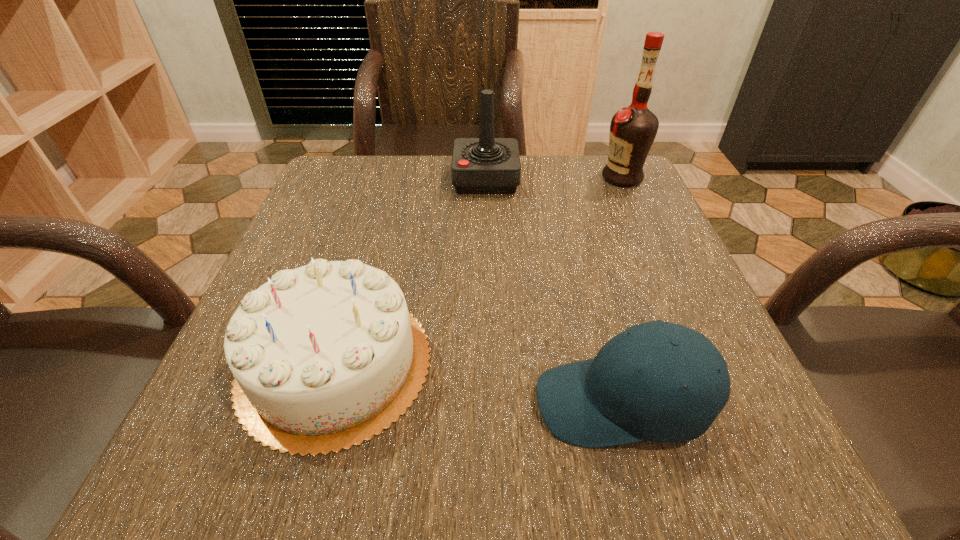
At what (x,y) coordinates should I click in order to perform the action: click on free space between the birthday cake and the liquor. Please return your answer as a coordinate pair (x, y). Image resolution: width=960 pixels, height=540 pixels. Looking at the image, I should click on pyautogui.click(x=478, y=270).

You are a GUI agent. You are given a task and a screenshot of the screen. Output one action in this format:
    pyautogui.click(x=<x>, y=<y>)
    Task: Click on the empty space that is in between the tallest object and the joystick
    The image size is (960, 540).
    Given the screenshot: What is the action you would take?
    pyautogui.click(x=554, y=178)

Select which object is the closest to the tallest object. Please provide its 2D coordinates. Your answer should be formatted as a tuple, i.e. [(x, y)], where the tuple contains the x and y coordinates of a point satisfying the conditions above.

[(486, 165)]

At what (x,y) coordinates should I click in order to perform the action: click on object that stands as the closest to the third shortest object. Please return your answer as a coordinate pair (x, y). Image resolution: width=960 pixels, height=540 pixels. Looking at the image, I should click on (633, 129).

Find the location of `blank area in the image that satisfies the following two spatial constraints: 1. on the front-facing side of the third shortest object; 2. on the front side of the birthday cake`. blank area in the image that satisfies the following two spatial constraints: 1. on the front-facing side of the third shortest object; 2. on the front side of the birthday cake is located at coordinates (489, 363).